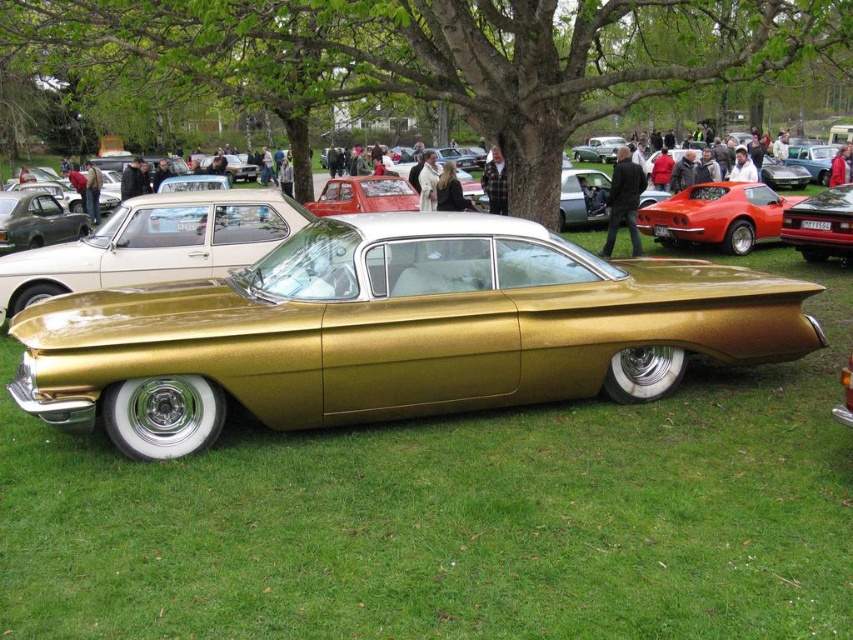
You are a photographer standing at the edge of the grassy area where the gold metallic car at center is parked. You want to take a photo of the shiny red car at right without moving closer. Can you fit both cars in the frame if your camera has a 50mm lens with a field of view of 46 degrees?

The distance between the gold metallic car at center and the shiny red car at right is 29.18 feet. To determine if both can fit in the frame, we calculate the maximum distance apart two objects can be at that distance with a 50mm lens. Using trigonometry, the field of view covers approximately 29.18 feet at 46 degrees. Since the separation matches the field width, both cars would just fit within the frame.

You are at a classic car exhibition and want to take a photo of the green leafy tree at center and the shiny red car at right. To frame them both in your camera, which object should you position to the left side of your frame?

You should position the green leafy tree at center to the left side of your frame since it is already to the left of the shiny red car at right.

You are a photographer planning to take a group photo of the gold metallic car at center and the shiny red car at right. Since you want both cars to appear proportionally sized in the photo, which car should you move closer to the camera and which should you move farther away?

The gold metallic car at center is larger than the shiny red car at right. To make them appear proportionally sized in the photo, you should move the gold metallic car at center farther away from the camera and the shiny red car at right closer to the camera.